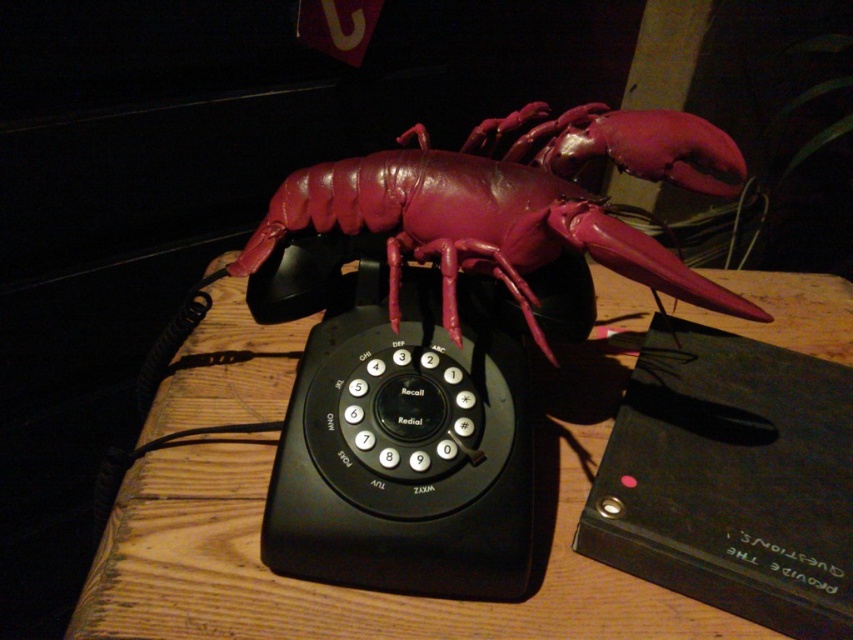
In the scene shown: You have a rectangular box that is 15 cm in width. You want to place it on the wooden table at center so that it doesn t touch the glossy plastic lobster at center. Is this possible?

The wooden table at center might be wider than glossy plastic lobster at center, so there is a possibility that the box can be placed without touching the lobster. However, the exact width difference is unknown, so it requires checking the actual dimensions.